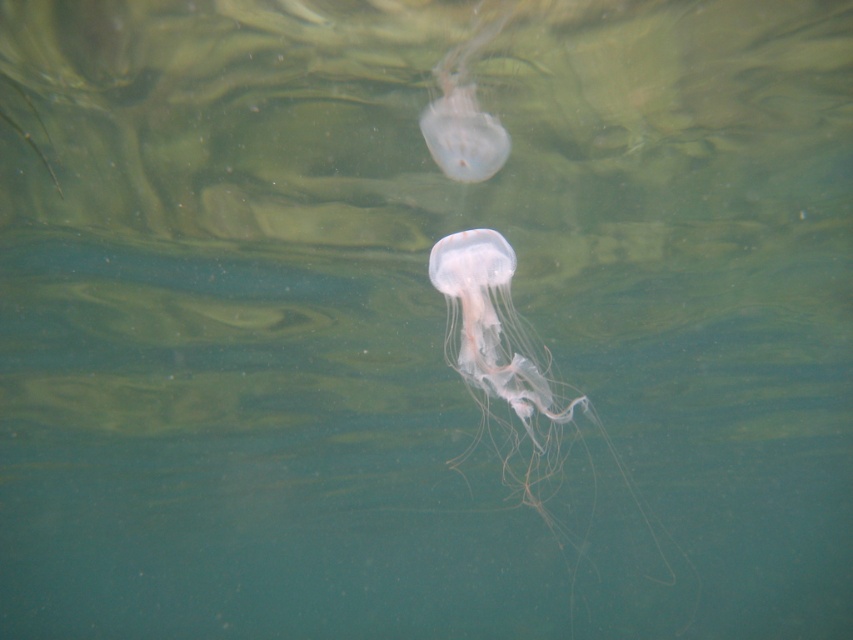
You are a diver who wants to reach the point marked as point (537, 364) in the underwater scene. The safety line you are holding can extend up to 15 feet. Can you safely reach the point without letting go of the line?

The point (537, 364) is 13.72 feet away from you, so yes, you can safely reach it since the safety line can extend up to 15 feet, which is longer than the distance required.

What is the exact location of the translucent gelatinous at center in the underwater scene?

The translucent gelatinous at center is located at point (515,384).

You are a marine biologist observing two jellyfish in an underwater scene. You notice the translucent gelatinous at center and the translucent gelatinous at upper center. Which of these two jellyfish is bigger?

The translucent gelatinous at center is larger in size than the translucent gelatinous at upper center, so the one at the center is bigger.